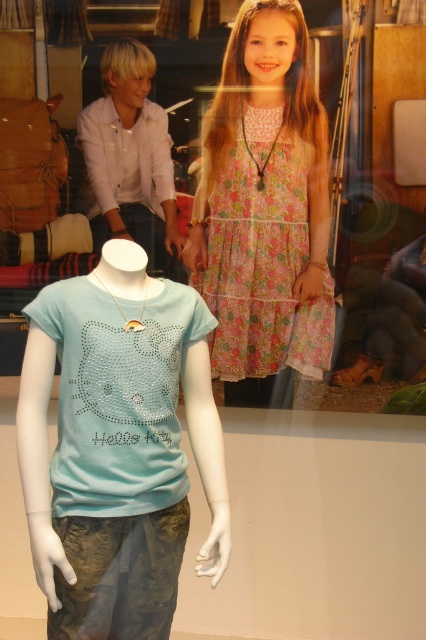
You are a store employee who needs to arrange the light blue jersey at center and the floral cotton dress at upper center on a shelf. The shelf is only 4 inches wide. Can both items fit side by side without overlapping?

The light blue jersey at center is 3.73 inches from the floral cotton dress at upper center, so yes, both items can fit side by side on the 4 inch wide shelf since the total required space is less than 4 inches.

You are a customer in a clothing store and see two light blue items at the center of the display. The items are the light blue jersey at center and the light blue fabric hello kitty shirt at center. Which one is closer to you?

The light blue jersey at center is closer to you because the light blue fabric hello kitty shirt at center is behind it.

You are standing in front of the retail display and want to place a new sticker on the point that is closer to you. Which point should you choose between the point at coordinates point (x=154, y=406) and point (x=296, y=308)?

Point (x=154, y=406) is in front of point (x=296, y=308), so you should choose point (x=154, y=406) as it is closer to you.